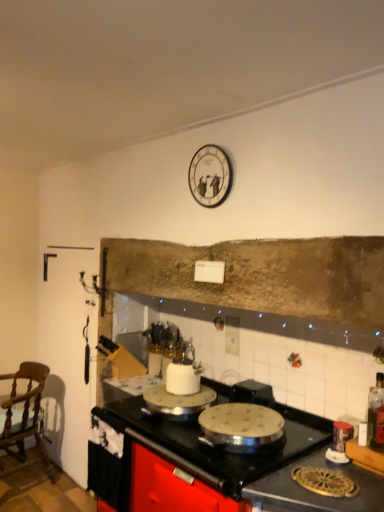
What do you see at coordinates (376, 413) in the screenshot?
I see `translucent glass bottle at right` at bounding box center [376, 413].

What do you see at coordinates (210, 176) in the screenshot?
I see `white glossy clock at upper center` at bounding box center [210, 176].

What are the coordinates of `black matte countertop at center` in the screenshot? It's located at (227, 467).

I want to click on wooden chair at left, so click(25, 414).

From the image's perspective, relative to metallic silver canister at lower right, is black matte countertop at center above or below?

Clearly, from the image's perspective, black matte countertop at center is below metallic silver canister at lower right.

Can you confirm if black matte countertop at center is taller than metallic silver canister at lower right?

Yes.

Is black matte countertop at center spatially inside metallic silver canister at lower right, or outside of it?

black matte countertop at center lies outside metallic silver canister at lower right.

Considering the positions of objects black matte countertop at center and metallic silver canister at lower right in the image provided, who is more to the right, black matte countertop at center or metallic silver canister at lower right?

Positioned to the right is metallic silver canister at lower right.

Image resolution: width=384 pixels, height=512 pixels. Find the location of `bottle lying above the wooden chair at left (from the image's perspective)`. bottle lying above the wooden chair at left (from the image's perspective) is located at coordinates (376, 413).

Is there a large distance between translucent glass bottle at right and wooden chair at left?

Yes, translucent glass bottle at right and wooden chair at left are located far from each other.

Considering the sizes of objects translucent glass bottle at right and wooden chair at left in the image provided, who is shorter, translucent glass bottle at right or wooden chair at left?

translucent glass bottle at right is shorter.

From the image's perspective, which is below, translucent glass bottle at right or wooden chair at left?

wooden chair at left, from the image's perspective.

In terms of size, does translucent glass bottle at right appear bigger or smaller than white glossy clock at upper center?

Considering their sizes, translucent glass bottle at right takes up less space than white glossy clock at upper center.

How much distance is there between translucent glass bottle at right and white glossy clock at upper center?

translucent glass bottle at right is 3.72 feet away from white glossy clock at upper center.

Can white glossy clock at upper center be found inside translucent glass bottle at right?

No, white glossy clock at upper center is not inside translucent glass bottle at right.

Is translucent glass bottle at right far away from white glossy clock at upper center?

translucent glass bottle at right is far away from white glossy clock at upper center.

From the image's perspective, which object appears higher, translucent glass bottle at right or metallic silver canister at lower right?

From the image's view, translucent glass bottle at right is above.

Considering the sizes of objects translucent glass bottle at right and metallic silver canister at lower right in the image provided, who is shorter, translucent glass bottle at right or metallic silver canister at lower right?

Standing shorter between the two is metallic silver canister at lower right.

Is translucent glass bottle at right far away from metallic silver canister at lower right?

No, translucent glass bottle at right is in close proximity to metallic silver canister at lower right.

Considering the positions of objects metallic silver canister at lower right and black matte countertop at center in the image provided, who is in front, metallic silver canister at lower right or black matte countertop at center?

black matte countertop at center is closer to the camera.

From a real-world perspective, is metallic silver canister at lower right above or below black matte countertop at center?

Clearly, from a real-world perspective, metallic silver canister at lower right is above black matte countertop at center.

Measure the distance between metallic silver canister at lower right and black matte countertop at center.

metallic silver canister at lower right and black matte countertop at center are 18.20 inches apart.

Does metallic silver canister at lower right turn towards black matte countertop at center?

No, metallic silver canister at lower right is not turned towards black matte countertop at center.

Is wooden chair at left spatially inside black matte countertop at center, or outside of it?

wooden chair at left is not enclosed by black matte countertop at center.

From the image's perspective, which object appears higher, wooden chair at left or black matte countertop at center?

black matte countertop at center, from the image's perspective.

Which is nearer, (x=26, y=403) or (x=225, y=456)?

Clearly, point (x=26, y=403) is more distant from the camera than point (x=225, y=456).

Considering the sizes of wooden chair at left and black matte countertop at center in the image, is wooden chair at left bigger or smaller than black matte countertop at center?

Considering their sizes, wooden chair at left takes up less space than black matte countertop at center.

Is white glossy clock at upper center situated inside black matte countertop at center or outside?

white glossy clock at upper center is located beyond the bounds of black matte countertop at center.

From the image's perspective, is white glossy clock at upper center on top of black matte countertop at center?

Indeed, from the image's perspective, white glossy clock at upper center is shown above black matte countertop at center.

Looking at this image, are white glossy clock at upper center and black matte countertop at center beside each other?

No, white glossy clock at upper center is not with black matte countertop at center.

This screenshot has height=512, width=384. Identify the location of countertop on the left of metallic silver canister at lower right. (227, 467).

The height and width of the screenshot is (512, 384). I want to click on chair below the translucent glass bottle at right (from a real-world perspective), so click(25, 414).

Estimate the real-world distances between objects in this image. Which object is closer to translucent glass bottle at right, black matte countertop at center or wooden chair at left?

black matte countertop at center.

Estimate the real-world distances between objects in this image. Which object is closer to metallic silver canister at lower right, translucent glass bottle at right or wooden chair at left?

Among the two, translucent glass bottle at right is located nearer to metallic silver canister at lower right.

Considering their positions, is wooden chair at left positioned further to metallic silver canister at lower right than white glossy clock at upper center?

The object further to metallic silver canister at lower right is wooden chair at left.

Based on the photo, looking at the image, which one is located closer to wooden chair at left, black matte countertop at center or white glossy clock at upper center?

The object closer to wooden chair at left is black matte countertop at center.

From the image, which object appears to be nearer to wooden chair at left, metallic silver canister at lower right or white glossy clock at upper center?

white glossy clock at upper center is closer to wooden chair at left.

From the image, which object appears to be farther from white glossy clock at upper center, translucent glass bottle at right or wooden chair at left?

Among the two, wooden chair at left is located further to white glossy clock at upper center.

Which object lies nearer to the anchor point translucent glass bottle at right, metallic silver canister at lower right or black matte countertop at center?

metallic silver canister at lower right is closer to translucent glass bottle at right.

Based on their spatial positions, is black matte countertop at center or metallic silver canister at lower right closer to translucent glass bottle at right?

metallic silver canister at lower right lies closer to translucent glass bottle at right than the other object.

Where is `clock between wooden chair at left and translucent glass bottle at right in the horizontal direction`? This screenshot has width=384, height=512. clock between wooden chair at left and translucent glass bottle at right in the horizontal direction is located at coordinates (210, 176).

This screenshot has height=512, width=384. I want to click on appliance between wooden chair at left and translucent glass bottle at right from left to right, so click(339, 442).

The height and width of the screenshot is (512, 384). Find the location of `appliance located between black matte countertop at center and translucent glass bottle at right in the left-right direction`. appliance located between black matte countertop at center and translucent glass bottle at right in the left-right direction is located at coordinates (339, 442).

This screenshot has width=384, height=512. What are the coordinates of `bottle between white glossy clock at upper center and metallic silver canister at lower right from top to bottom` in the screenshot? It's located at (376, 413).